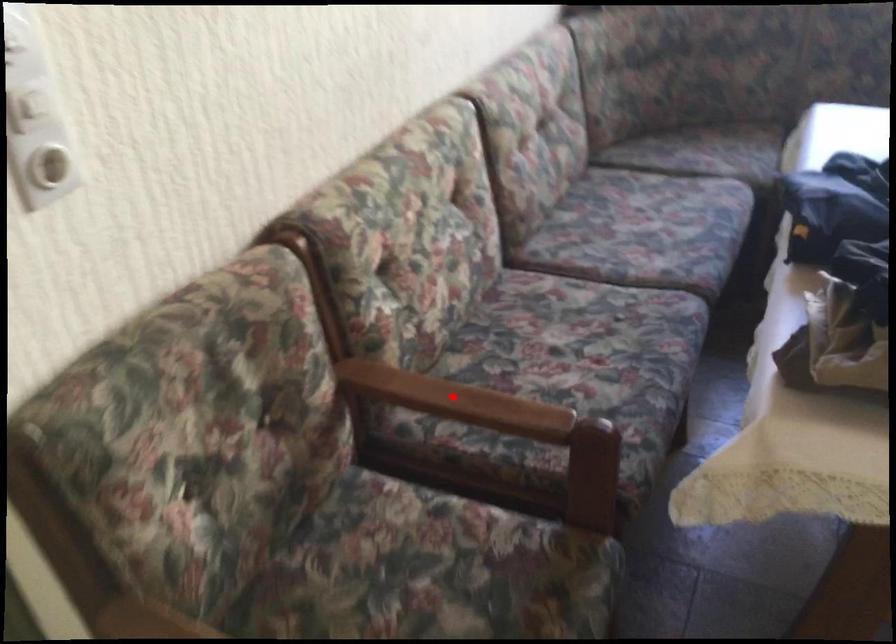
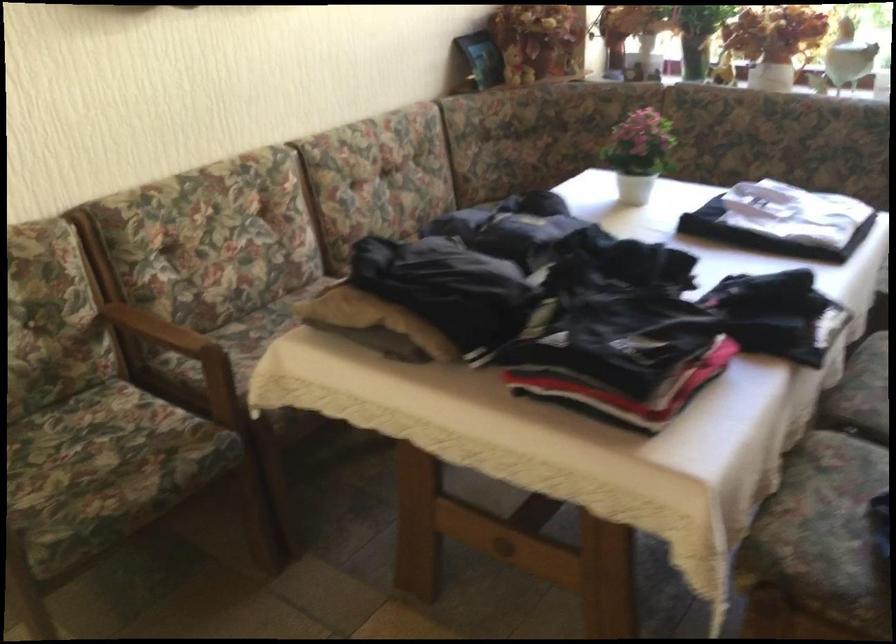
In the second image, find the point that corresponds to the highlighted location in the first image.

(158, 328)